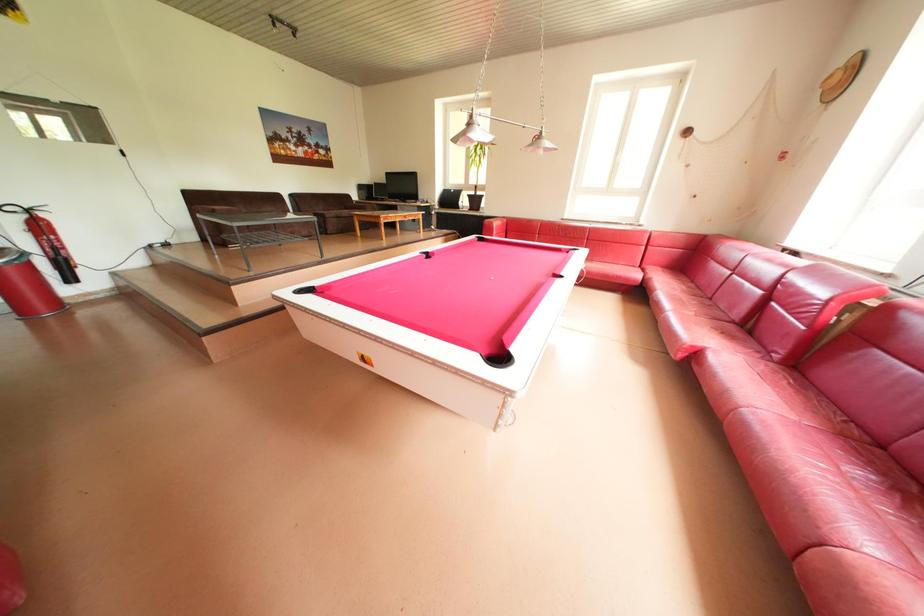
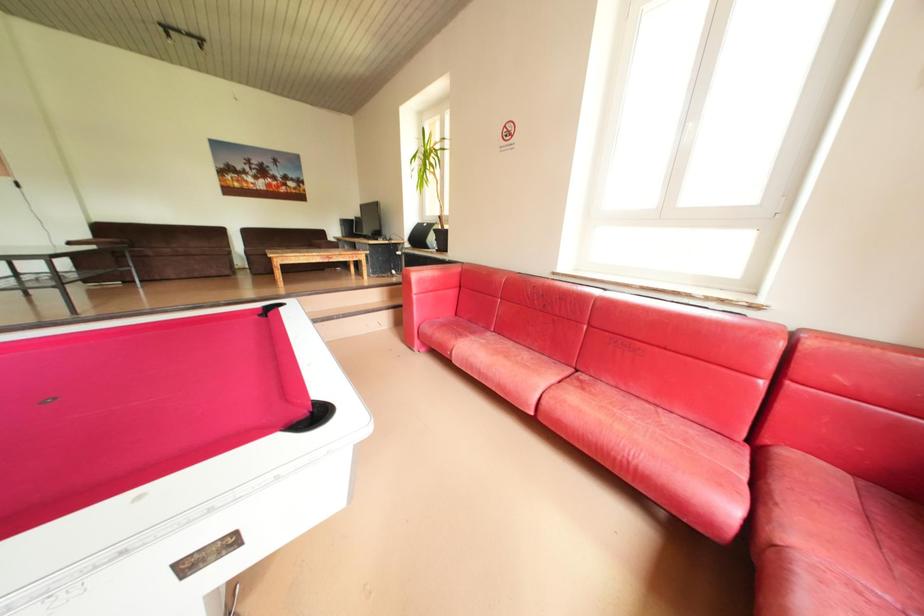
What movement of the cameraman would produce the second image?

The cameraman moved toward right, forward.